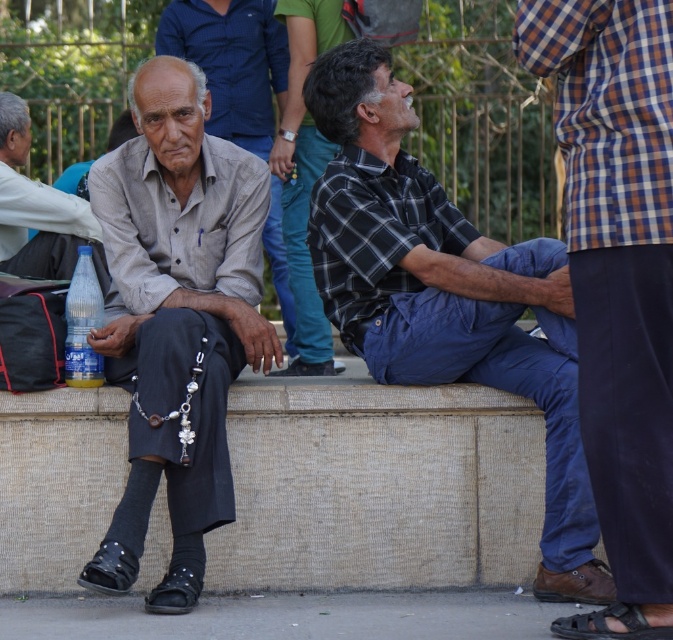
Question: Among these points, which one is farthest from the camera?

Choices:
 (A) (248, 4)
 (B) (199, 186)
 (C) (7, 148)
 (D) (90, 276)

Answer: (A)

Question: Is checkered shirt at center bigger than black leather sandal at lower right?

Choices:
 (A) no
 (B) yes

Answer: (B)

Question: Which point is closer to the camera?

Choices:
 (A) gray fabric shirt at left
 (B) black leather sandal at lower right
 (C) matte plastic bottle at left

Answer: (B)

Question: Which object appears closest to the camera in this image?

Choices:
 (A) blue cotton pants at lower right
 (B) checkered shirt at center
 (C) matte plastic bottle at left
 (D) black leather sandal at lower right

Answer: (A)

Question: Is checkered shirt at center positioned behind blue cotton pants at lower right?

Choices:
 (A) no
 (B) yes

Answer: (B)

Question: Does matte plastic bottle at left appear over black leather sandal at lower right?

Choices:
 (A) no
 (B) yes

Answer: (B)